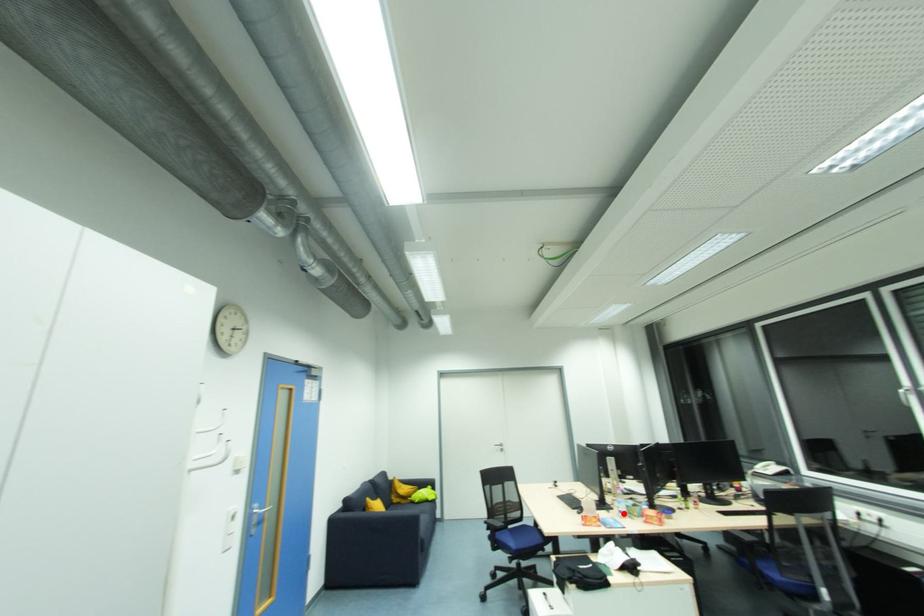
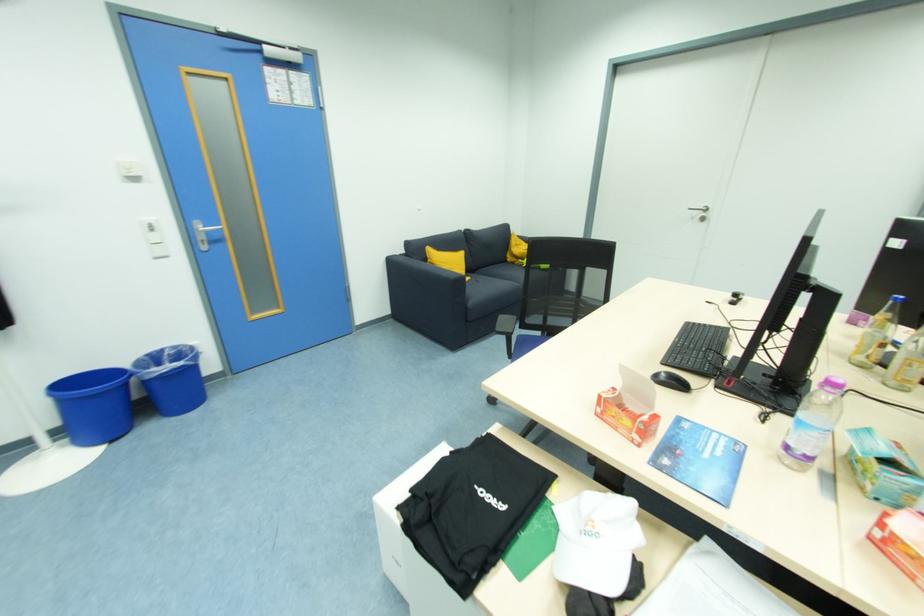
The point at the highlighted location is marked in the first image. Where is the corresponding point in the second image?

(792, 448)